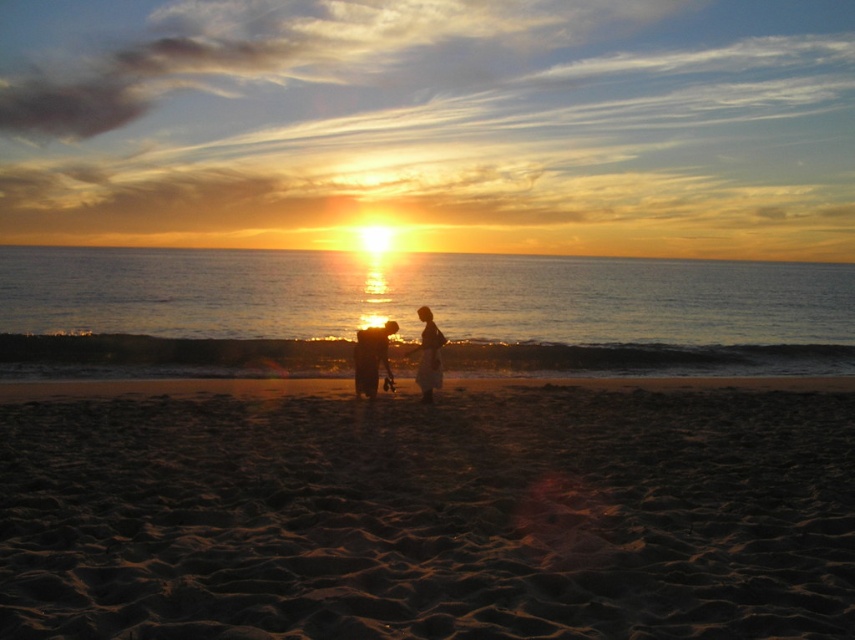
Question: Which point is farther from the camera taking this photo?

Choices:
 (A) (417, 376)
 (B) (364, 346)
 (C) (364, 385)
 (D) (292, 614)

Answer: (B)

Question: Can you confirm if silhouette sand at center is positioned to the left of silhouette fabric person at center?

Choices:
 (A) yes
 (B) no

Answer: (A)

Question: Is dark brown textured sand at center positioned before silhouette wooden couple at center?

Choices:
 (A) no
 (B) yes

Answer: (B)

Question: Does dark brown textured sand at center appear over silhouette wooden couple at center?

Choices:
 (A) no
 (B) yes

Answer: (A)

Question: Which of these objects is positioned closest to the silhouette sand at center?

Choices:
 (A) silhouette fabric person at center
 (B) silhouette wooden couple at center

Answer: (B)

Question: Among these objects, which one is farthest from the camera?

Choices:
 (A) silhouette sand at center
 (B) dark brown textured sand at center

Answer: (A)